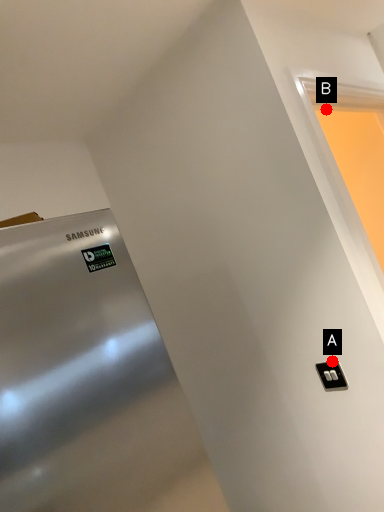
Question: Two points are circled on the image, labeled by A and B beside each circle. Among these points, which one is nearest to the camera?

Choices:
 (A) A is closer
 (B) B is closer

Answer: (A)